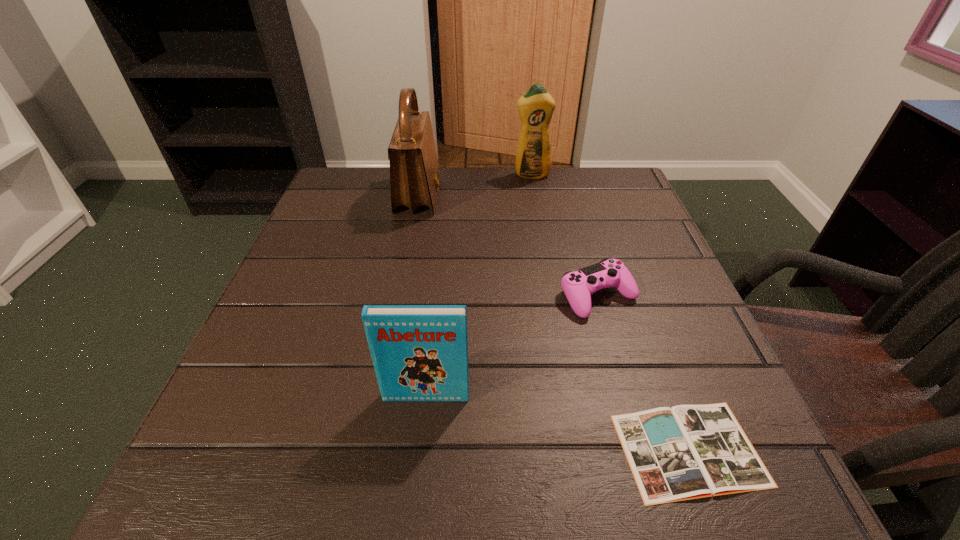
Identify the location of free space located on the front cover of the left book. (419, 475).

Identify the location of free spot located on the back of the fourth tallest object. (574, 213).

Identify the location of vacant space positioned on the left of the nearer book. The image size is (960, 540). (489, 450).

Identify the location of shoulder bag that is at the far edge. The height and width of the screenshot is (540, 960). (414, 170).

Image resolution: width=960 pixels, height=540 pixels. Find the location of `detergent situated at the far edge`. detergent situated at the far edge is located at coordinates (533, 157).

The width and height of the screenshot is (960, 540). Find the location of `object that is at the near edge`. object that is at the near edge is located at coordinates (685, 452).

Find the location of a particular element. The height and width of the screenshot is (540, 960). control present at the right edge is located at coordinates (578, 286).

Where is `book at the right edge`? book at the right edge is located at coordinates (685, 452).

Where is `object that is positioned at the near right corner`? object that is positioned at the near right corner is located at coordinates (685, 452).

This screenshot has width=960, height=540. In the image, there is a desktop. Find the location of `vacant region at the far edge`. vacant region at the far edge is located at coordinates (464, 204).